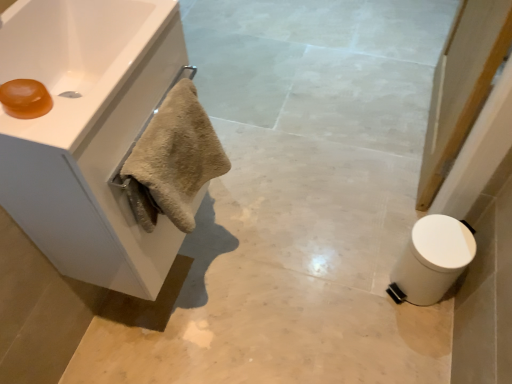
The image size is (512, 384). In order to click on free point below white matte cabinet at upper left (from a real-world perspective) in this screenshot , I will do `click(175, 271)`.